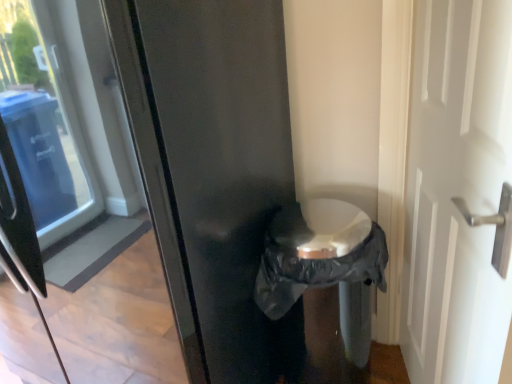
Question: Looking at the image, does white glossy door at right seem bigger or smaller compared to matte black refrigerator at center?

Choices:
 (A) big
 (B) small

Answer: (B)

Question: In terms of width, does white glossy door at right look wider or thinner when compared to matte black refrigerator at center?

Choices:
 (A) wide
 (B) thin

Answer: (B)

Question: Considering the real-world distances, which object is closest to the matte black refrigerator at center?

Choices:
 (A) white glossy door at right
 (B) black plastic bag at center

Answer: (B)

Question: Considering the real-world distances, which object is closest to the black plastic bag at center?

Choices:
 (A) white glossy door at right
 (B) matte black refrigerator at center

Answer: (A)